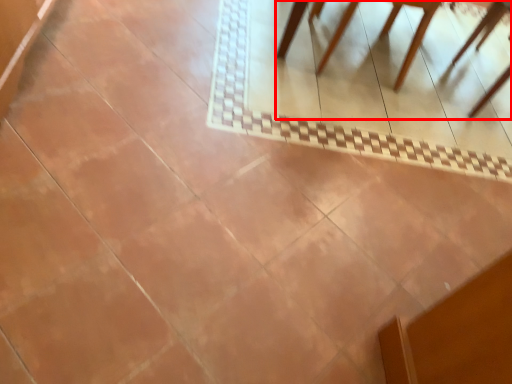
Question: From the image's perspective, where is furniture (annotated by the red box) located in relation to chair in the image?

Choices:
 (A) above
 (B) below

Answer: (A)